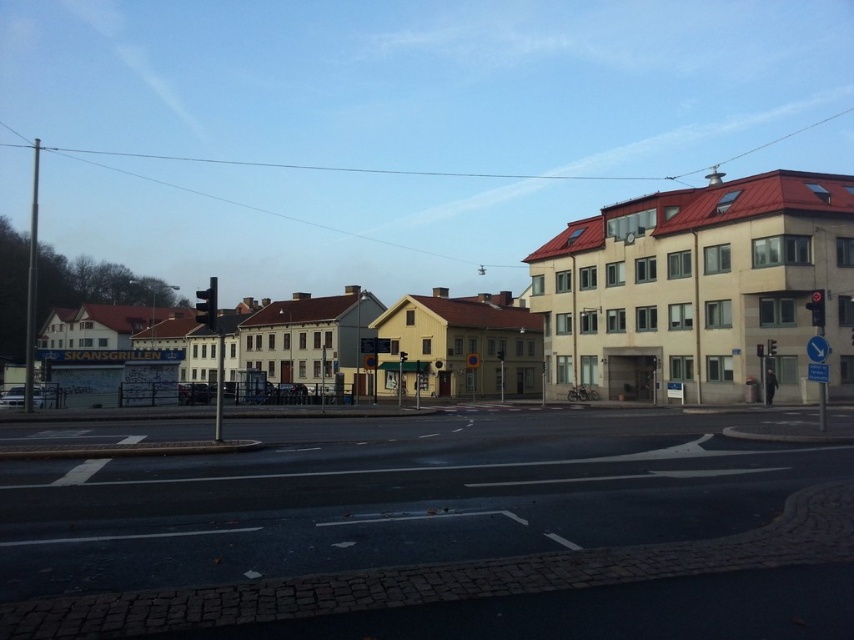
Can you confirm if metallic traffic light at left is smaller than red glass traffic light at right?

No.

Is point (209, 305) less distant than point (817, 324)?

Yes, point (209, 305) is closer to viewer.

Where is `metallic traffic light at left`? metallic traffic light at left is located at coordinates (208, 305).

Can you confirm if red glass traffic light at right is bigger than red glass traffic light at upper center?

Indeed, red glass traffic light at right has a larger size compared to red glass traffic light at upper center.

Does red glass traffic light at right appear under red glass traffic light at upper center?

No, red glass traffic light at right is not below red glass traffic light at upper center.

You are a GUI agent. You are given a task and a screenshot of the screen. Output one action in this format:
    pyautogui.click(x=<x>, y=<y>)
    Task: Click on the red glass traffic light at right
    
    Given the screenshot: What is the action you would take?
    pyautogui.click(x=816, y=307)

You are a GUI agent. You are given a task and a screenshot of the screen. Output one action in this format:
    pyautogui.click(x=<x>, y=<y>)
    Task: Click on the red glass traffic light at right
    The image size is (854, 640).
    Given the screenshot: What is the action you would take?
    pyautogui.click(x=816, y=307)

Is metallic traffic light at left smaller than red glass traffic light at upper center?

No.

Locate an element on the screen. Image resolution: width=854 pixels, height=640 pixels. metallic traffic light at left is located at coordinates (208, 305).